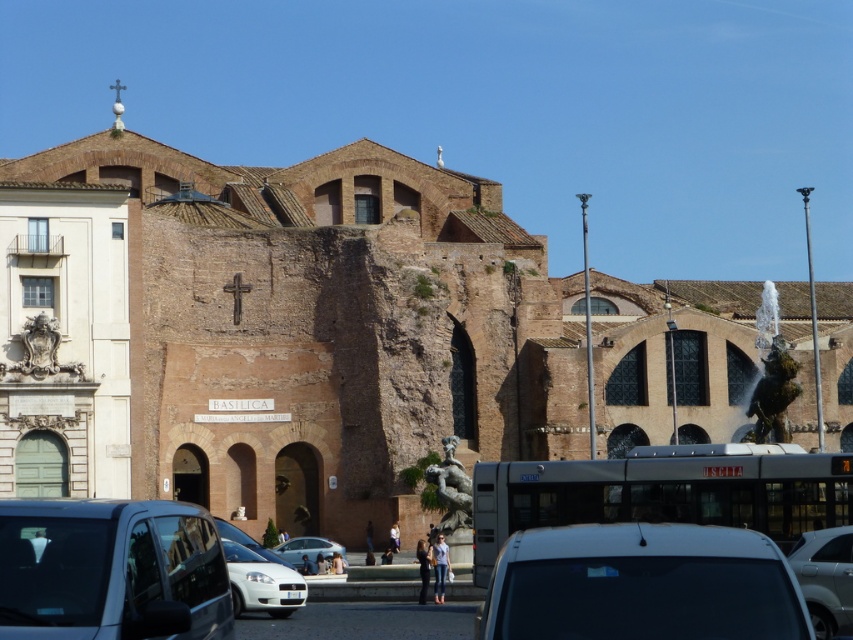
Measure the distance between white matte car at lower center and white matte car at center.

15.42 meters

Who is positioned more to the left, white matte car at lower center or white matte car at center?

From the viewer's perspective, white matte car at lower center appears more on the left side.

Is point (253, 580) behind point (309, 556)?

No, it is in front of (309, 556).

Where is `white matte car at lower center`? The image size is (853, 640). white matte car at lower center is located at coordinates 260,582.

From the picture: Between white matte van at lower center and silver metallic sedan at center, which one appears on the left side from the viewer's perspective?

From the viewer's perspective, white matte van at lower center appears more on the left side.

Is white matte van at lower center above silver metallic sedan at center?

Correct, white matte van at lower center is located above silver metallic sedan at center.

Is point (666, 582) closer to viewer compared to point (843, 568)?

Yes.

Image resolution: width=853 pixels, height=640 pixels. In order to click on white matte van at lower center in this screenshot , I will do `click(642, 584)`.

Is white matte van at lower center shorter than white matte car at lower center?

Incorrect, white matte van at lower center's height does not fall short of white matte car at lower center's.

Which is below, white matte van at lower center or white matte car at lower center?

Positioned lower is white matte car at lower center.

Between point (701, 534) and point (265, 570), which one is positioned in front?

Positioned in front is point (701, 534).

Identify the location of white matte van at lower center. (642, 584).